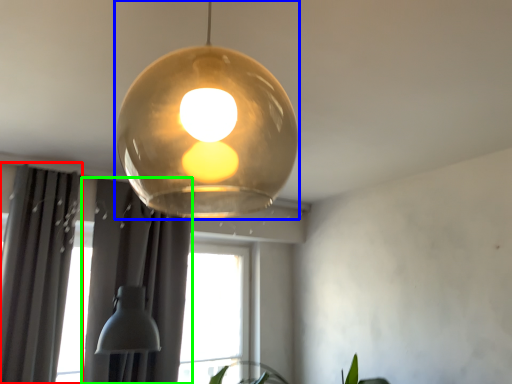
Question: Which object is the closest to the curtain (highlighted by a red box)? Choose among these: lamp (highlighted by a blue box) or curtain (highlighted by a green box).

Choices:
 (A) lamp
 (B) curtain

Answer: (B)